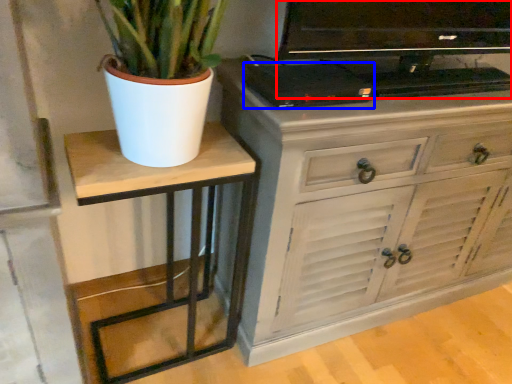
Question: Which point is closer to the camera, television (highlighted by a red box) or appliance (highlighted by a blue box)?

Choices:
 (A) television
 (B) appliance

Answer: (A)